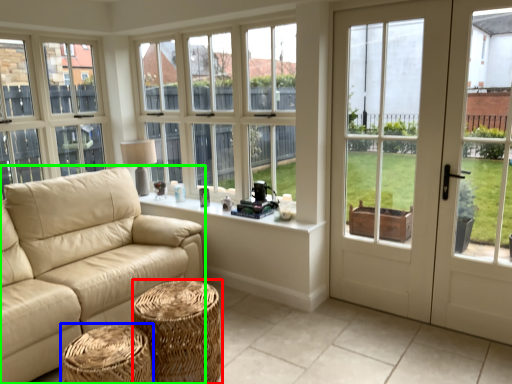
Question: Which object is positioned closest to stool (highlighted by a red box)? Select from stool (highlighted by a blue box) and studio couch (highlighted by a green box).

Choices:
 (A) stool
 (B) studio couch

Answer: (A)